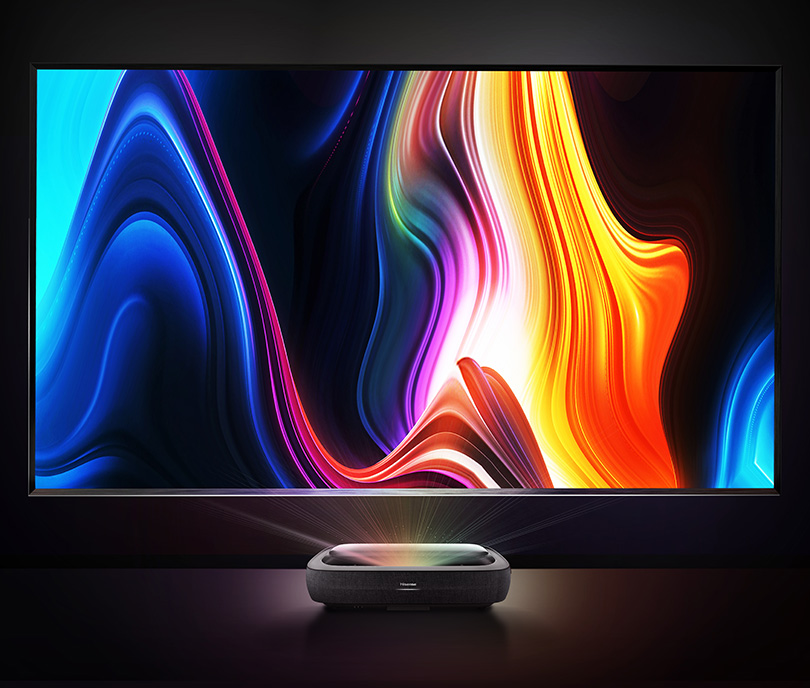
This screenshot has width=810, height=688. In order to click on table in this screenshot , I will do `click(641, 609)`.